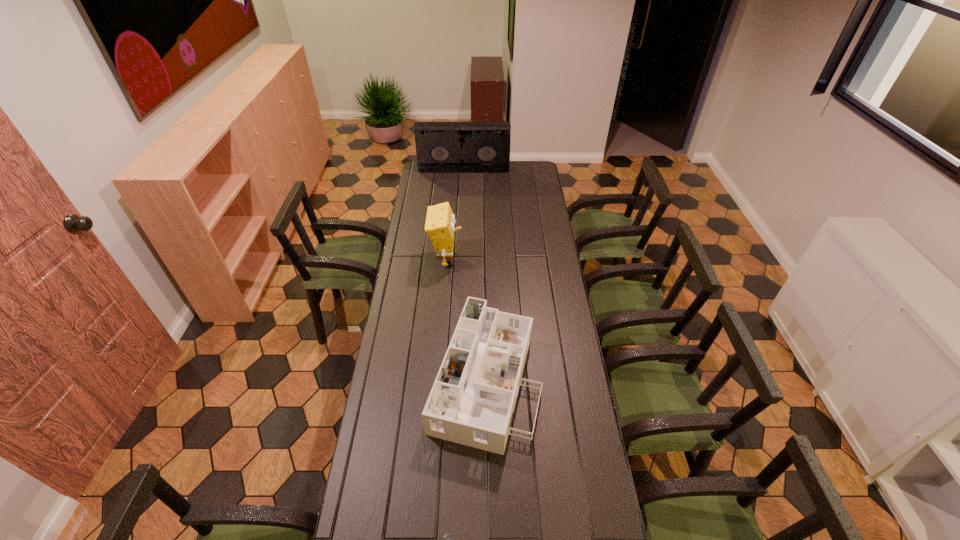
I want to click on the farthest object, so click(441, 147).

The image size is (960, 540). Identify the location of sponge. (440, 221).

Locate an element on the screen. The height and width of the screenshot is (540, 960). the second shortest object is located at coordinates (473, 397).

Where is `dollhouse`? dollhouse is located at coordinates tap(473, 397).

The width and height of the screenshot is (960, 540). Identify the location of free spot located 0.330m on the front side of the videotape. (462, 204).

What are the coordinates of `vacant region located 0.140m on the face of the third nearest object` in the screenshot? It's located at (492, 259).

Where is `vacant space positioned on the back of the second shortest object`? The height and width of the screenshot is (540, 960). vacant space positioned on the back of the second shortest object is located at coordinates (484, 263).

Identify the location of object that is at the far edge. This screenshot has height=540, width=960. (441, 147).

What are the coordinates of `videotape that is positioned at the left edge` in the screenshot? It's located at (441, 147).

Where is `sponge located in the left edge section of the desktop`? sponge located in the left edge section of the desktop is located at coordinates (440, 221).